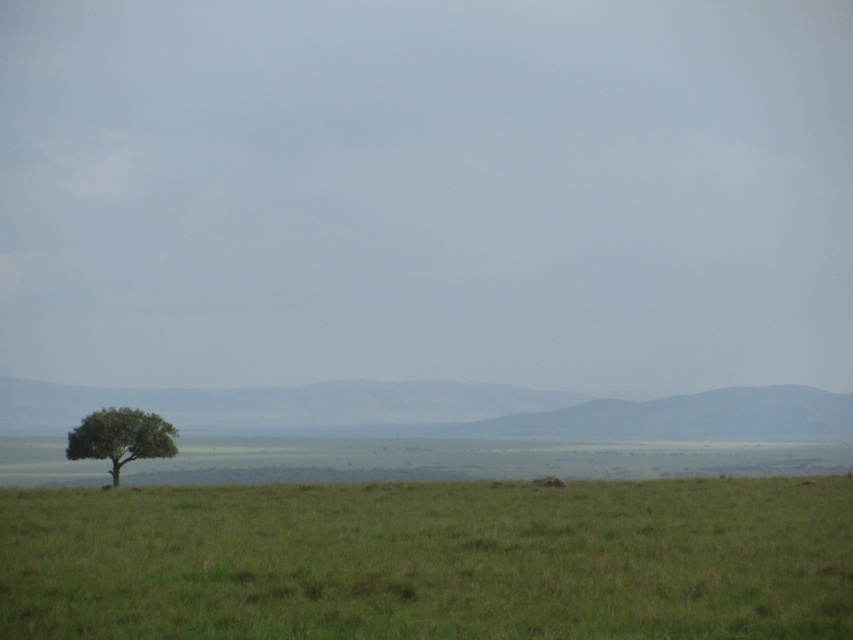
Question: Does green grassy plain at lower center appear on the left side of green leafy tree at lower left?

Choices:
 (A) no
 (B) yes

Answer: (A)

Question: Among these objects, which one is nearest to the camera?

Choices:
 (A) green leafy tree at lower left
 (B) green grassy plain at lower center

Answer: (B)

Question: Is green grassy plain at lower center positioned before green leafy tree at lower left?

Choices:
 (A) no
 (B) yes

Answer: (B)

Question: Can you confirm if green grassy plain at lower center is positioned below green leafy tree at lower left?

Choices:
 (A) yes
 (B) no

Answer: (B)

Question: Which point is closer to the camera?

Choices:
 (A) green grassy plain at lower center
 (B) green leafy tree at lower left

Answer: (A)